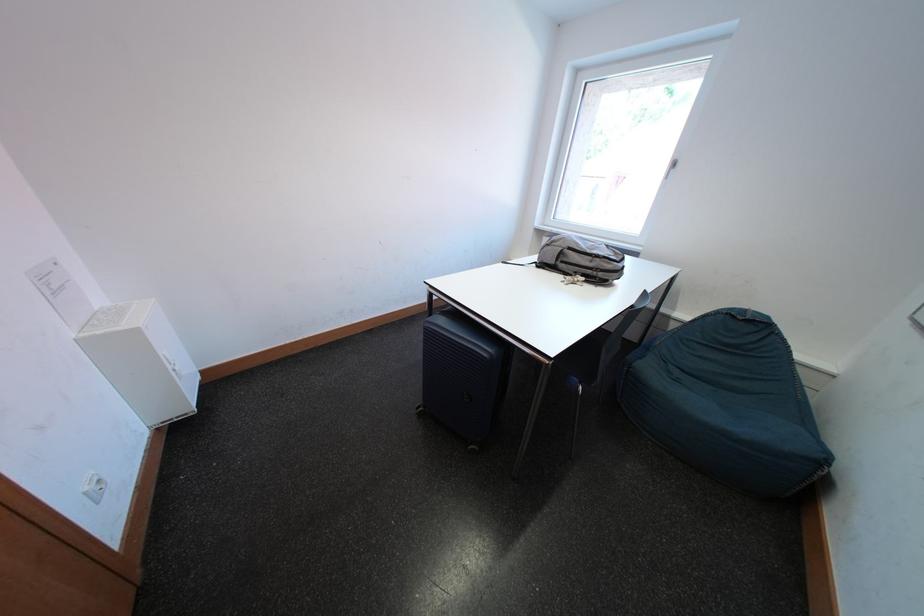
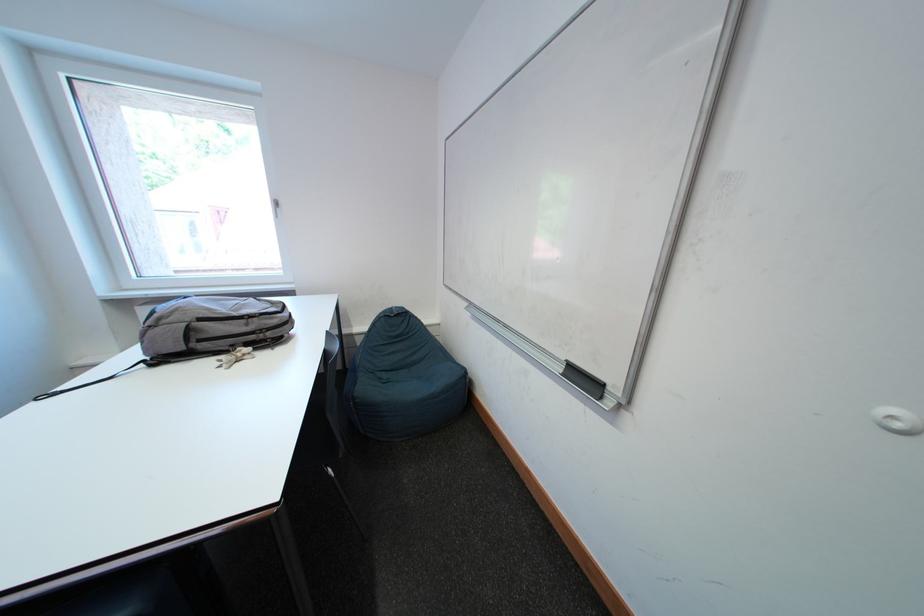
In the second image, find the point that corresponds to (x=687, y=376) in the first image.

(394, 379)